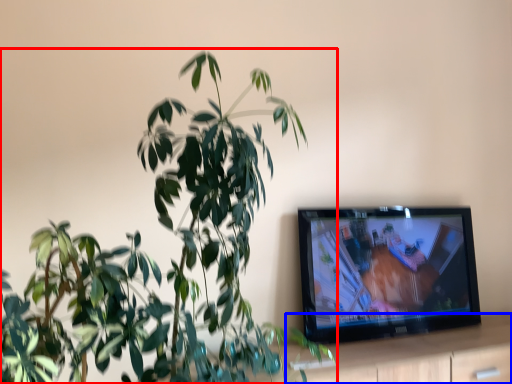
Question: Which point is closer to the camera, houseplant (highlighted by a red box) or dresser (highlighted by a blue box)?

Choices:
 (A) houseplant
 (B) dresser

Answer: (A)